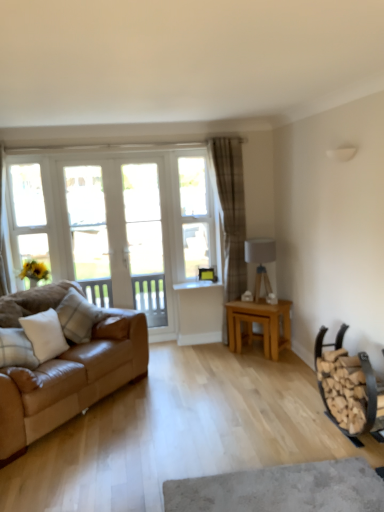
This screenshot has height=512, width=384. In order to click on brown plaid curtain at center in this screenshot , I will do `click(231, 213)`.

What do you see at coordinates (347, 386) in the screenshot? The width and height of the screenshot is (384, 512). I see `wooden firewood rack at lower right` at bounding box center [347, 386].

The height and width of the screenshot is (512, 384). What do you see at coordinates (260, 261) in the screenshot?
I see `matte gray fabric at center-right` at bounding box center [260, 261].

Measure the distance between clear glass window at center and camera.

4.46 meters.

Image resolution: width=384 pixels, height=512 pixels. What are the coordinates of `white glossy screen door at left, the second screen door when ordered from right to left` in the screenshot? It's located at (118, 234).

Where is `brown plaid curtain at center`? The width and height of the screenshot is (384, 512). brown plaid curtain at center is located at coordinates (231, 213).

From a real-world perspective, who is located higher, white cotton pillow at left, which ranks as the second pillow in back-to-front order, or white glossy screen door at left, the 1th screen door in the left-to-right sequence?

From a 3D spatial view, white glossy screen door at left, the 1th screen door in the left-to-right sequence, is above.

Which is in front, point (66, 342) or point (108, 295)?

The point (66, 342) is in front.

Which object is positioned more to the left, white cotton pillow at left, which ranks as the second pillow in back-to-front order, or white glossy screen door at left, the 1th screen door in the left-to-right sequence?

white cotton pillow at left, which ranks as the second pillow in back-to-front order.

Is white cotton pillow at left, the 1th pillow when ordered from front to back, positioned in front of white glossy screen door at left, the second screen door when ordered from right to left?

Yes, the depth of white cotton pillow at left, the 1th pillow when ordered from front to back, is less than that of white glossy screen door at left, the second screen door when ordered from right to left.

From a real-world perspective, which object stands above the other?

In real-world perspective, white painted wood window frame at left is above.

Is white painted wood window frame at left positioned far away from brown plaid curtain at center?

Yes, white painted wood window frame at left and brown plaid curtain at center are located far from each other.

Which of these two, white painted wood window frame at left or brown plaid curtain at center, is wider?

brown plaid curtain at center is wider.

Looking at this image, is light brown wooden table at center bigger than clear glass window at center?

Yes, light brown wooden table at center is bigger than clear glass window at center.

How far apart are light brown wooden table at center and clear glass window at center?

light brown wooden table at center and clear glass window at center are 38.50 inches apart from each other.

From the image's perspective, which is below, light brown wooden table at center or clear glass window at center?

light brown wooden table at center appears lower in the image.

Between point (269, 334) and point (196, 234), which one is positioned in front?

The point (269, 334) is closer to the camera.

Between light brown wooden table at center and white painted wood window frame at left, which one appears on the right side from the viewer's perspective?

Positioned to the right is light brown wooden table at center.

Considering the relative sizes of light brown wooden table at center and white painted wood window frame at left in the image provided, is light brown wooden table at center taller than white painted wood window frame at left?

Incorrect, the height of light brown wooden table at center is not larger of that of white painted wood window frame at left.

Is light brown wooden table at center far away from white painted wood window frame at left?

light brown wooden table at center is far away from white painted wood window frame at left.

This screenshot has height=512, width=384. Identify the location of table located underneath the white painted wood window frame at left (from a real-world perspective). coord(259,323).

From the image's perspective, would you say wooden firewood rack at lower right is shown under light brown wooden table at center?

Yes, from the image's perspective, wooden firewood rack at lower right is beneath light brown wooden table at center.

Which of these two, wooden firewood rack at lower right or light brown wooden table at center, is bigger?

wooden firewood rack at lower right is bigger.

Between wooden firewood rack at lower right and light brown wooden table at center, which one has smaller width?

wooden firewood rack at lower right.

Between white glossy screen door at left, the 1th screen door in the left-to-right sequence, and plaid fabric pillow at left, which appears as the 2th pillow when viewed from the front, which one has larger size?

With larger size is white glossy screen door at left, the 1th screen door in the left-to-right sequence.

Would you say white glossy screen door at left, the second screen door when ordered from right to left, contains plaid fabric pillow at left, acting as the first pillow starting from the back?

Actually, plaid fabric pillow at left, acting as the first pillow starting from the back, is outside white glossy screen door at left, the second screen door when ordered from right to left.

From a real-world perspective, which object stands above the other?

white glossy screen door at left, the second screen door when ordered from right to left.

There is a white painted wood window frame at left. Identify the location of the 2nd pillow below it (from the image's perspective). The image size is (384, 512). (44, 334).

Is white cotton pillow at left, which ranks as the second pillow in back-to-front order, at the left side of white painted wood window frame at left?

Incorrect, white cotton pillow at left, which ranks as the second pillow in back-to-front order, is not on the left side of white painted wood window frame at left.

From a real-world perspective, which object stands above the other?

From a 3D spatial view, white painted wood window frame at left is above.

From the image's perspective, is white cotton pillow at left, the 1th pillow when ordered from front to back, beneath white painted wood window frame at left?

Yes, from the image's perspective, white cotton pillow at left, the 1th pillow when ordered from front to back, is below white painted wood window frame at left.

The height and width of the screenshot is (512, 384). I want to click on the 1st screen door behind when counting from the white cotton pillow at left, which ranks as the second pillow in back-to-front order, so click(118, 234).

This screenshot has height=512, width=384. In order to click on curtain below the white painted wood window frame at left (from the image's perspective) in this screenshot , I will do `click(231, 213)`.

Based on their spatial positions, is matte gray fabric at center-right or leather couch at left further from white painted wood window frame at left?

matte gray fabric at center-right is positioned further to the anchor white painted wood window frame at left.

Estimate the real-world distances between objects in this image. Which object is further from brown plaid curtain at center, white glossy screen door at left, the second screen door when ordered from right to left, or wooden firewood rack at lower right?

wooden firewood rack at lower right is positioned further to the anchor brown plaid curtain at center.

Looking at the image, which one is located closer to white painted wood window frame at left, wooden firewood rack at lower right or brown plaid curtain at center?

brown plaid curtain at center is closer to white painted wood window frame at left.

Estimate the real-world distances between objects in this image. Which object is closer to leather couch at left, brown plaid curtain at center or plaid fabric pillow at left, acting as the first pillow starting from the back?

The object closer to leather couch at left is plaid fabric pillow at left, acting as the first pillow starting from the back.

From the image, which object appears to be farther from matte gray fabric at center-right, white glossy screen door at left, the 1th screen door in the left-to-right sequence, or clear glass window at center?

white glossy screen door at left, the 1th screen door in the left-to-right sequence, is positioned further to the anchor matte gray fabric at center-right.

Looking at the image, which one is located closer to brown plaid curtain at center, leather couch at left or matte gray fabric at center-right?

Based on the image, matte gray fabric at center-right appears to be nearer to brown plaid curtain at center.

Estimate the real-world distances between objects in this image. Which object is further from wooden firewood rack at lower right, leather couch at left or white cotton pillow at left, the 1th pillow when ordered from front to back?

white cotton pillow at left, the 1th pillow when ordered from front to back.

When comparing their distances from white glossy screen door at left, the second screen door when ordered from right to left, does matte gray fabric at center-right or plaid fabric pillow at left, acting as the first pillow starting from the back, seem closer?

plaid fabric pillow at left, acting as the first pillow starting from the back, lies closer to white glossy screen door at left, the second screen door when ordered from right to left, than the other object.

What are the coordinates of `studio couch between wooden firewood rack at lower right and clear glass window at center from front to back` in the screenshot? It's located at (x=68, y=365).

Image resolution: width=384 pixels, height=512 pixels. I want to click on window frame located between white cotton pillow at left, the 1th pillow when ordered from front to back, and white glossy screen door at left, the 1th screen door in the left-to-right sequence, in the depth direction, so click(x=29, y=214).

Image resolution: width=384 pixels, height=512 pixels. I want to click on window situated between white glossy screen door at left, the 1th screen door in the left-to-right sequence, and matte gray fabric at center-right from left to right, so click(196, 216).

The height and width of the screenshot is (512, 384). I want to click on screen door located between white glossy screen door at left, the 1th screen door in the left-to-right sequence, and clear glass window at center in the left-right direction, so click(145, 240).